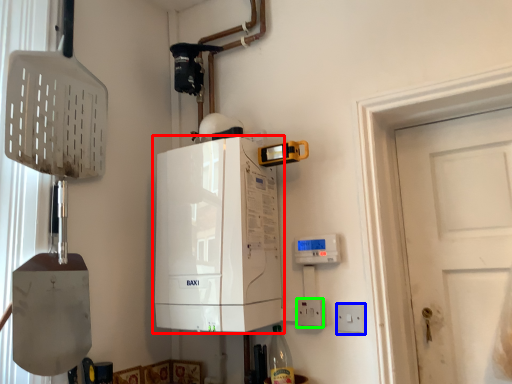
Question: Which object is the farthest from home appliance (highlighted by a red box)? Choose among these: electric outlet (highlighted by a blue box) or electric outlet (highlighted by a green box).

Choices:
 (A) electric outlet
 (B) electric outlet

Answer: (A)